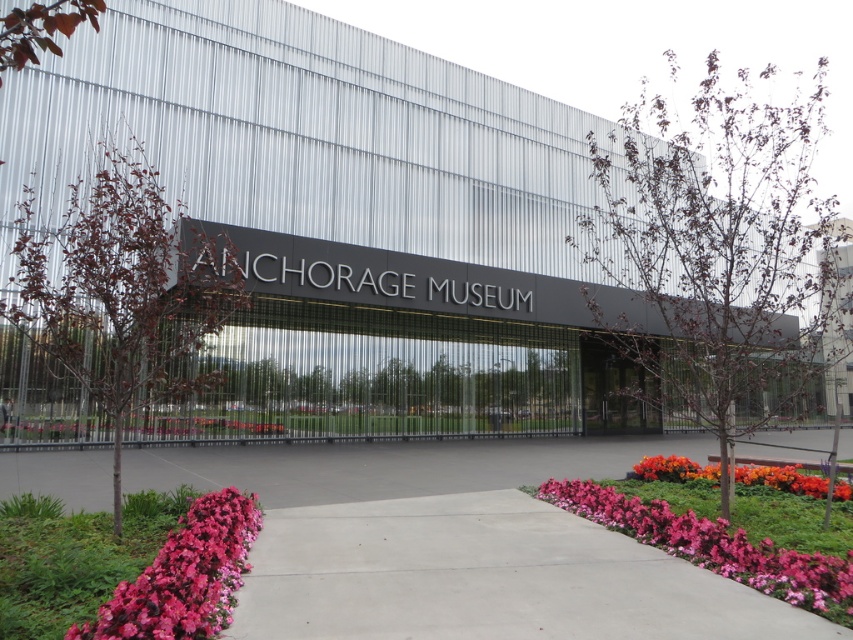
You are a visitor approaching the Anchorage Museum entrance. You see the concrete at center and the orange matte flower at lower right. Which object is closer to the museum entrance?

The concrete at center is closer to the museum entrance because it is in front of the orange matte flower at lower right.

You are a gardener planning to plant a new flower bed. You have a limited space of 1 square meter. Given the sizes of the concrete at center and orange matte flower at lower right in the scene, which object would be more suitable to replicate in your small space?

The orange matte flower at lower right is more suitable for the small space since it is smaller in size compared to the concrete at center.

You are standing at the entrance of the Anchorage Museum and notice two flowerbeds. One has pink matte flowers at lower left and the other has orange matte flower at lower right. Which flowerbed has the larger flowers?

The orange matte flower at lower right is larger than the pink matte flowers at lower left.